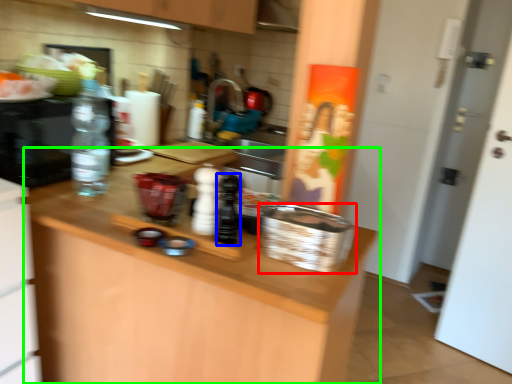
Question: Considering the real-world distances, which object is closest to basket (highlighted by a red box)? bottle (highlighted by a blue box) or countertop (highlighted by a green box).

Choices:
 (A) bottle
 (B) countertop

Answer: (A)